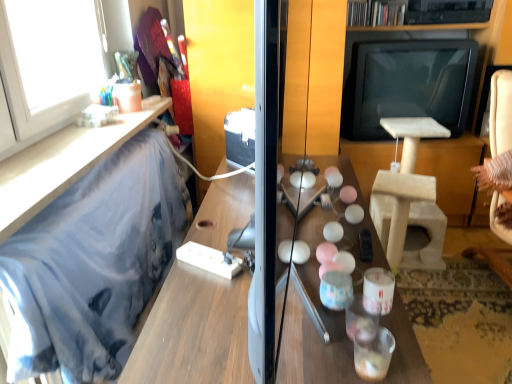
Find the location of a particular element. free point above blue fabric at left, the first furniture from the top (from a real-world perspective) is located at coordinates (80, 137).